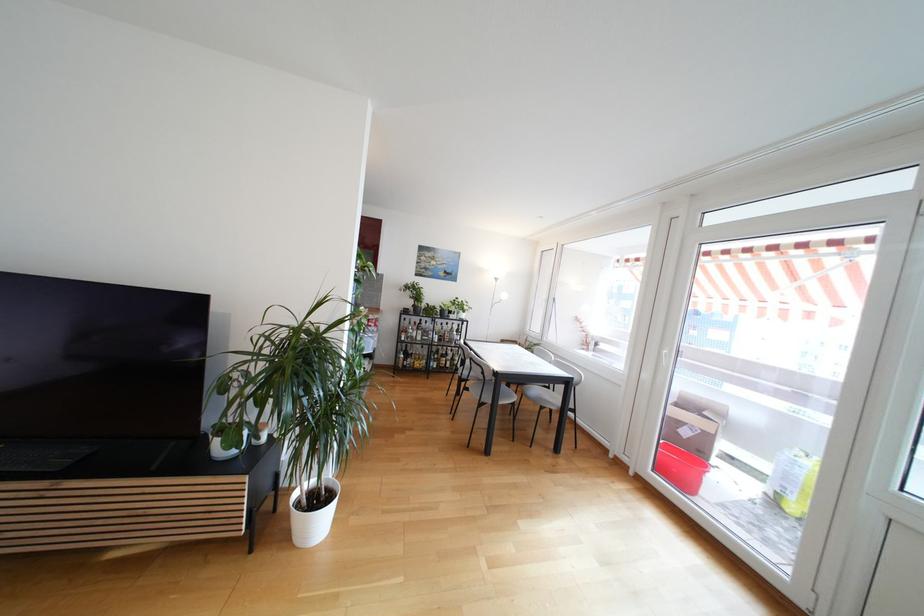
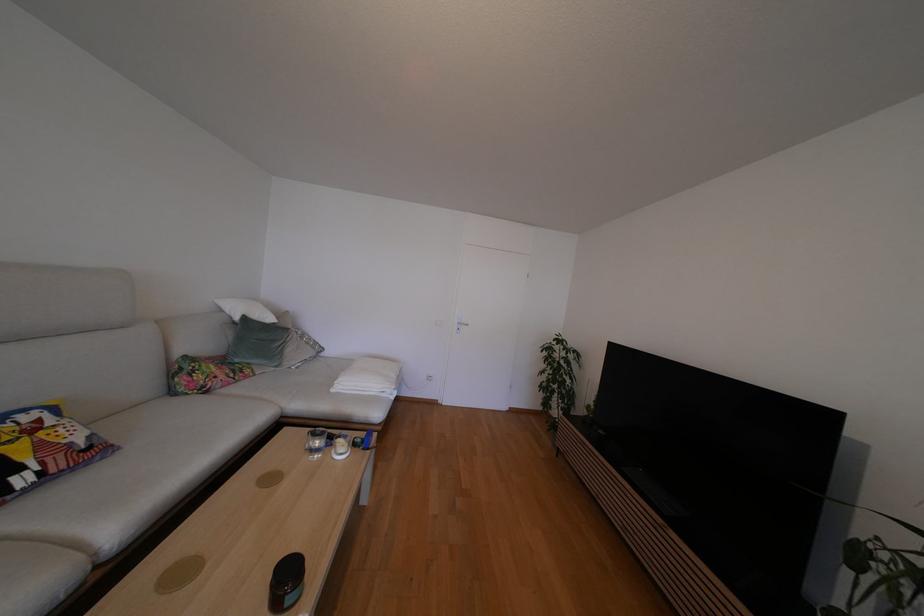
Question: The camera is either moving clockwise (left) or counter-clockwise (right) around the object. The first image is from the beginning of the video and the second image is from the end. Is the camera moving left or right when shooting the video?

Choices:
 (A) Left
 (B) Right

Answer: (B)